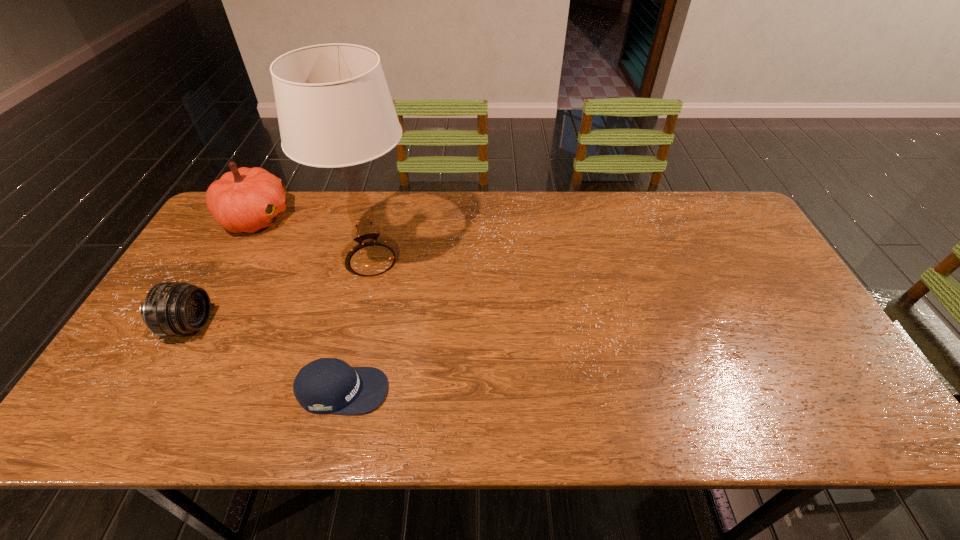
In order to click on free spot between the table lamp and the baseball cap in this screenshot , I will do `click(357, 325)`.

Image resolution: width=960 pixels, height=540 pixels. In order to click on vacant point located between the table lamp and the second nearest object in this screenshot , I will do `click(280, 293)`.

Where is `empty space between the pumpkin and the second nearest object`? empty space between the pumpkin and the second nearest object is located at coordinates (223, 272).

This screenshot has width=960, height=540. Identify the location of free space between the shortest object and the table lamp. [x=357, y=325].

In order to click on free space between the telephoto lens and the third shortest object in this screenshot , I will do `click(223, 272)`.

You are a GUI agent. You are given a task and a screenshot of the screen. Output one action in this format:
    pyautogui.click(x=<x>, y=<y>)
    Task: Click on the blank region between the table lamp and the shortest object
    The height and width of the screenshot is (540, 960).
    Given the screenshot: What is the action you would take?
    pyautogui.click(x=357, y=325)

I want to click on free spot between the third shortest object and the baseball cap, so click(x=300, y=304).

Locate an element on the screen. The height and width of the screenshot is (540, 960). free space that is in between the table lamp and the telephoto lens is located at coordinates (280, 293).

Identify the location of free space between the table lamp and the telephoto lens. (280, 293).

Identify the location of empty space that is in between the third shortest object and the nearest object. (300, 304).